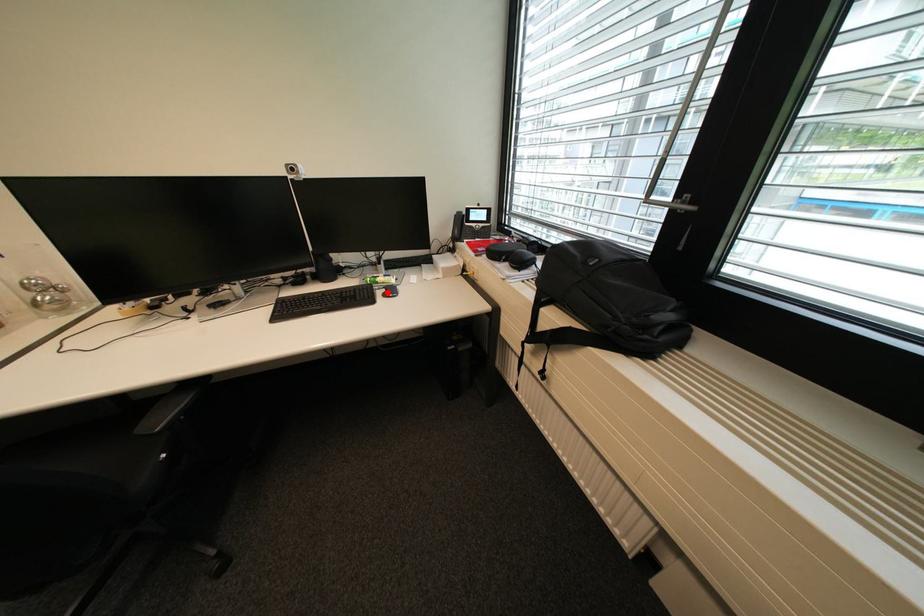
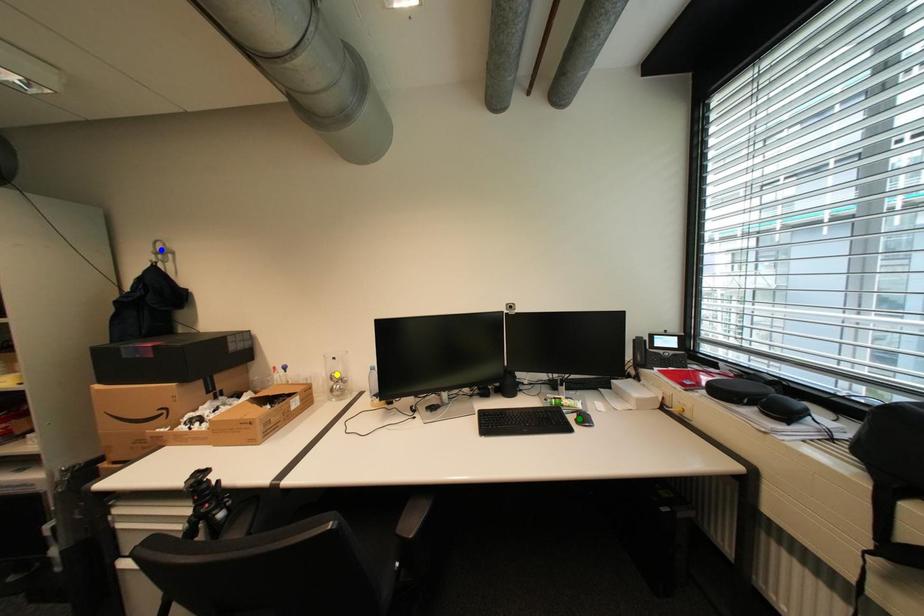
Question: I am providing you with two images of the same scene from different viewpoints. A red point is marked on the first image. You are given multiple points on the second image. Which mark in image 2 goes with the point in image 1?

Choices:
 (A) blue point
 (B) green point
 (C) yellow point

Answer: (B)